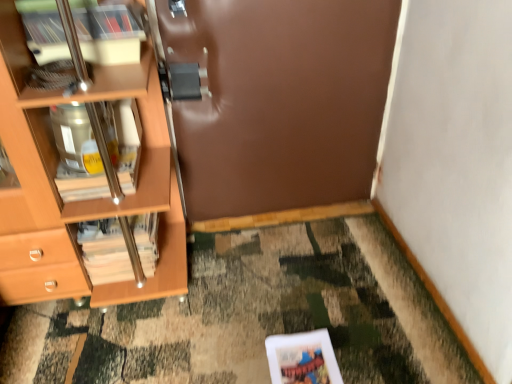
Question: From their relative heights in the image, would you say wooden cabinet at left is taller or shorter than wooden/matte magazine at left?

Choices:
 (A) tall
 (B) short

Answer: (B)

Question: Considering the positions of wooden cabinet at left and wooden/matte magazine at left in the image, is wooden cabinet at left bigger or smaller than wooden/matte magazine at left?

Choices:
 (A) big
 (B) small

Answer: (B)

Question: Which object is the farthest from the wooden cabinet at left?

Choices:
 (A) brown matte door at center
 (B) wooden/matte magazine at left

Answer: (A)

Question: Which object is the farthest from the wooden cabinet at left?

Choices:
 (A) brown matte door at center
 (B) wooden/matte magazine at left

Answer: (A)